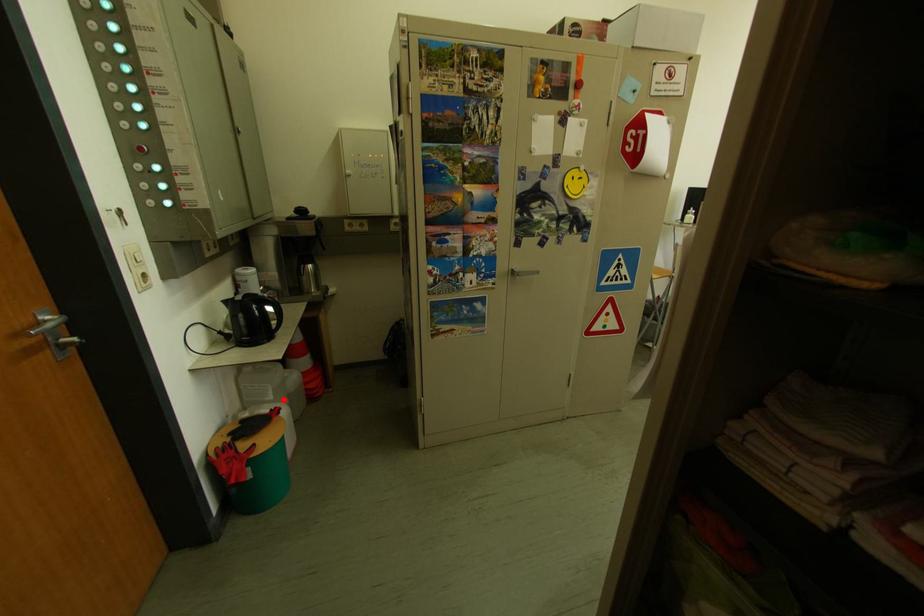
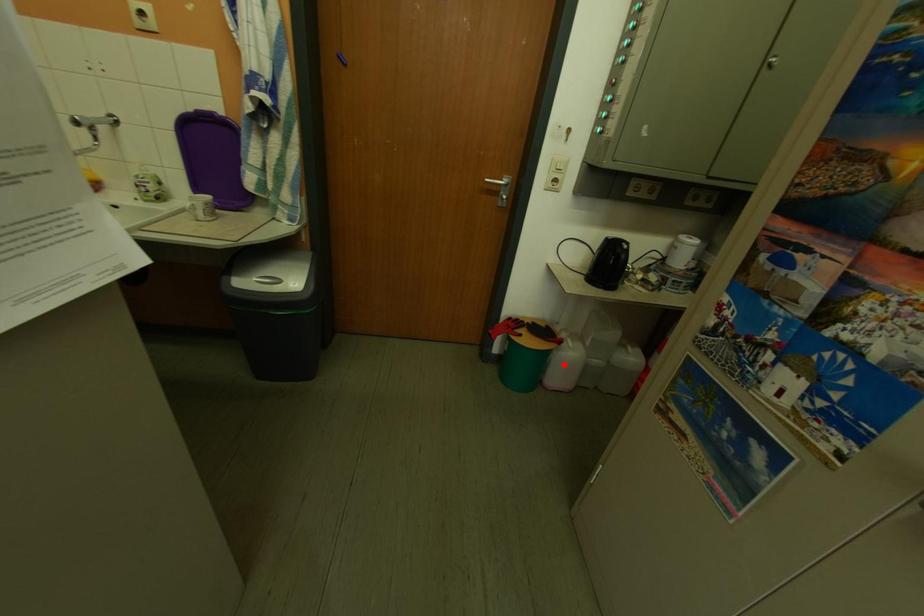
I am providing you with two images of the same scene from different viewpoints. A red point is marked on the first image and another point is marked on the second image. Is the marked point in image1 the same physical position as the marked point in image2?

No